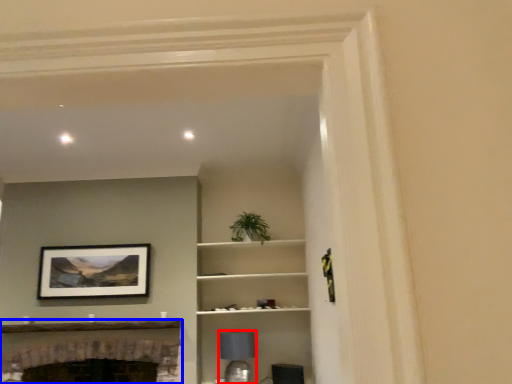
Question: Among these objects, which one is nearest to the camera, lamp (highlighted by a red box) or fireplace (highlighted by a blue box)?

Choices:
 (A) lamp
 (B) fireplace

Answer: (B)